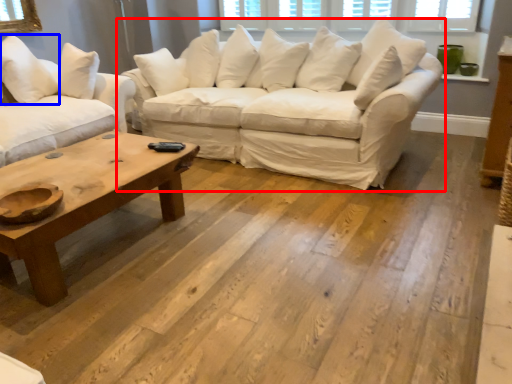
Question: Among these objects, which one is nearest to the camera, studio couch (highlighted by a red box) or pillow (highlighted by a blue box)?

Choices:
 (A) studio couch
 (B) pillow

Answer: (A)